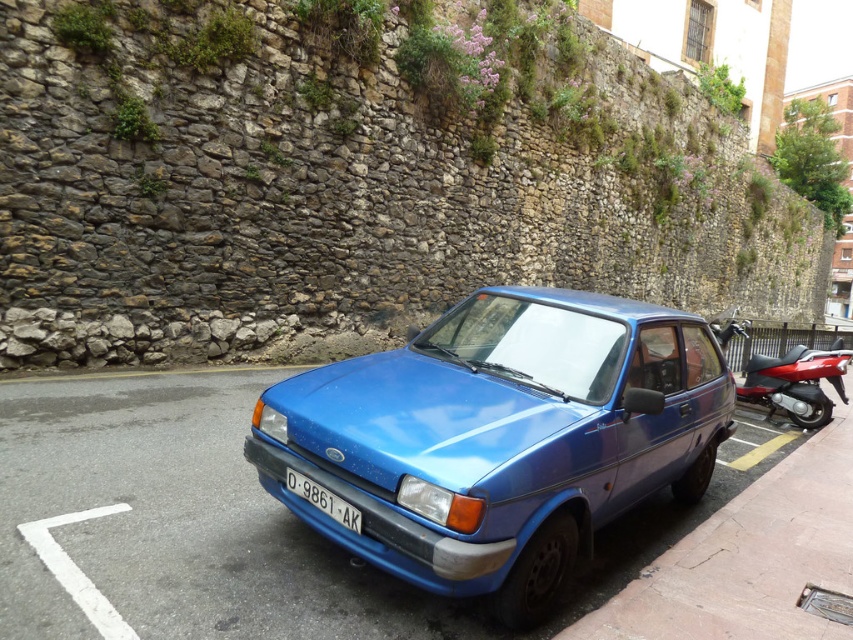
Can you confirm if metallic blue car at center is wider than black plastic license plate at center?

Correct, the width of metallic blue car at center exceeds that of black plastic license plate at center.

Between point (502, 326) and point (335, 506), which one is positioned behind?

The point (502, 326) is behind.

Describe the element at coordinates (502, 436) in the screenshot. The height and width of the screenshot is (640, 853). I see `metallic blue car at center` at that location.

You are a GUI agent. You are given a task and a screenshot of the screen. Output one action in this format:
    pyautogui.click(x=<x>, y=<y>)
    Task: Click on the metallic blue car at center
    The height and width of the screenshot is (640, 853).
    Given the screenshot: What is the action you would take?
    pyautogui.click(x=502, y=436)

Which of these two, metallic blue car at center or blue asphalt pavement at center, stands taller?

metallic blue car at center

In the scene shown: Does metallic blue car at center have a lesser height compared to blue asphalt pavement at center?

No, metallic blue car at center is not shorter than blue asphalt pavement at center.

Is point (555, 490) positioned behind point (74, 394)?

No.

Locate an element on the screen. metallic blue car at center is located at coordinates (502, 436).

Does shiny red motorcycle at right have a lesser height compared to black plastic license plate at center?

In fact, shiny red motorcycle at right may be taller than black plastic license plate at center.

Is shiny red motorcycle at right to the left of black plastic license plate at center from the viewer's perspective?

No, shiny red motorcycle at right is not to the left of black plastic license plate at center.

This screenshot has height=640, width=853. What are the coordinates of `shiny red motorcycle at right` in the screenshot? It's located at (787, 374).